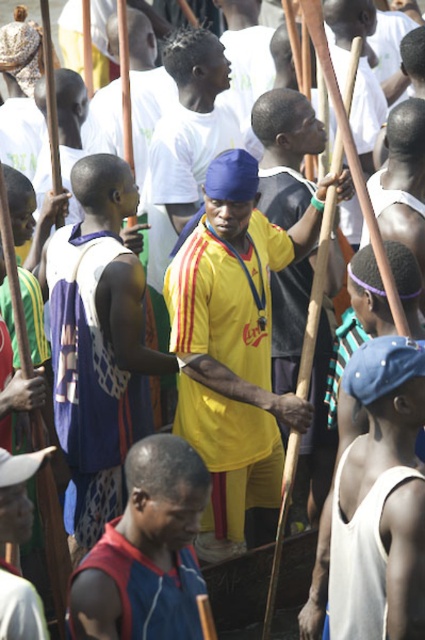
Question: Is yellow matte shirt at center closer to camera compared to reddish-brown fabric shirt at lower left?

Choices:
 (A) no
 (B) yes

Answer: (A)

Question: Which of the following is the closest to the observer?

Choices:
 (A) (186, 269)
 (B) (95, 602)

Answer: (B)

Question: Is yellow matte shirt at center bigger than reddish-brown fabric shirt at lower left?

Choices:
 (A) yes
 (B) no

Answer: (A)

Question: Which object appears closest to the camera in this image?

Choices:
 (A) yellow matte shirt at center
 (B) reddish-brown fabric shirt at lower left

Answer: (B)

Question: Which of the following is the closest to the observer?

Choices:
 (A) reddish-brown fabric shirt at lower left
 (B) yellow matte shirt at center

Answer: (A)

Question: Observing the image, what is the correct spatial positioning of yellow matte shirt at center in reference to reddish-brown fabric shirt at lower left?

Choices:
 (A) left
 (B) right

Answer: (B)